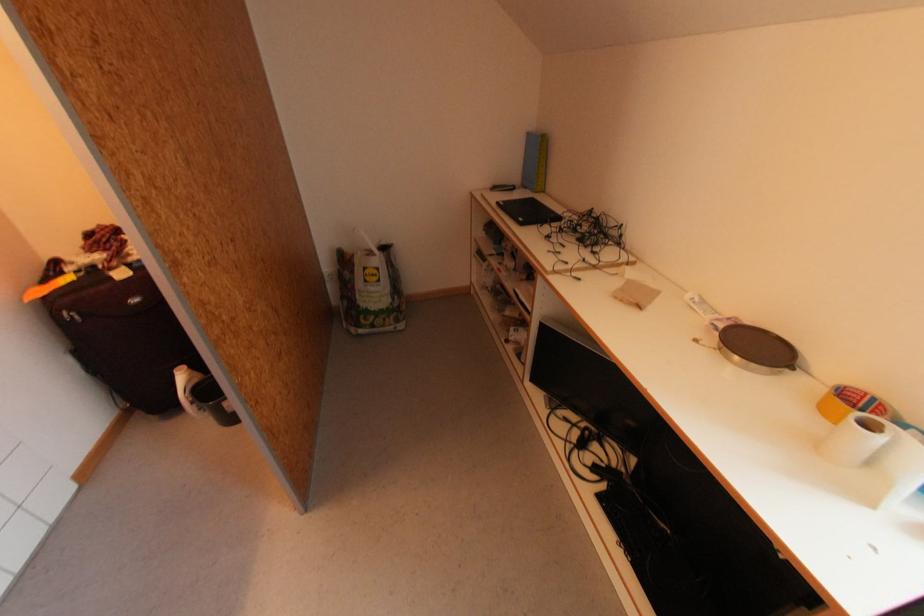
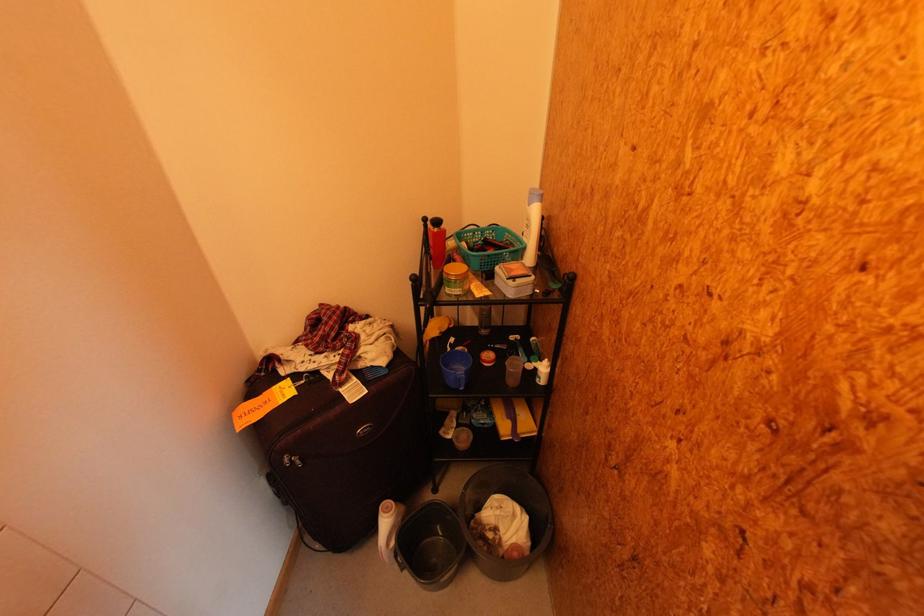
In the second image, find the point that corresponds to (x=191, y=398) in the first image.

(393, 546)